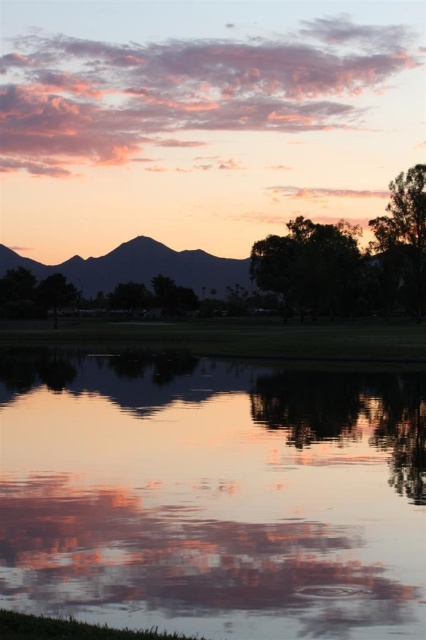
You are an artist sketching the landscape and want to ensure the silvery metallic mountain at center and the green leafy tree at right are placed correctly in your drawing. According to the scene, which object should appear higher in your sketch?

The silvery metallic mountain at center should appear higher in the sketch because it is positioned over the green leafy tree at right.

You are an artist trying to paint this landscape. You want to ensure the green leafy tree at upper right and the green leafy tree at center are proportionally accurate. Which tree should you draw wider in your painting?

The green leafy tree at upper right should be drawn wider than the green leafy tree at center because it might be wider according to the description.

You are standing in the serene landscape scene and want to touch both the point at coordinates point (215, 291) and the point at coordinates point (425, 288). Which point should you reach for first if you want to touch the closer one?

You should reach for point (215, 291) first because it is closer to you than point (425, 288), which is further away.